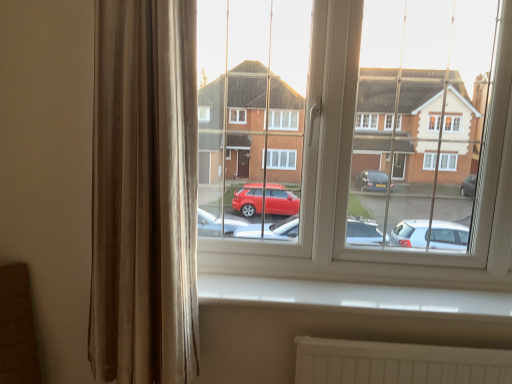
What is the approximate width of white plastic window sill at lower center?

white plastic window sill at lower center is 7.74 inches in width.

What do you see at coordinates (352, 295) in the screenshot?
I see `white plastic window sill at lower center` at bounding box center [352, 295].

Identify the location of velvet beige curtain at left. This screenshot has height=384, width=512. coord(144,193).

Is white plastic window sill at lower center bigger than velvet beige curtain at left?

No, white plastic window sill at lower center is not bigger than velvet beige curtain at left.

From a real-world perspective, is white plastic window sill at lower center located higher than velvet beige curtain at left?

No.

Is there a large distance between white plastic window sill at lower center and velvet beige curtain at left?

That's not correct — white plastic window sill at lower center is a little close to velvet beige curtain at left.

Which point is more forward, (318, 302) or (105, 142)?

The point (105, 142) is closer.

Between transparent glass window at center and white plastic window sill at lower center, which one has larger width?

white plastic window sill at lower center is wider.

Which is closer, (x=258, y=261) or (x=298, y=285)?

Positioned in front is point (x=298, y=285).

From a real-world perspective, which is physically below, transparent glass window at center or white plastic window sill at lower center?

white plastic window sill at lower center is physically lower.

Would you say transparent glass window at center is outside white plastic window sill at lower center?

Yes, transparent glass window at center is outside of white plastic window sill at lower center.

Does white plastic window sill at lower center have a smaller size compared to transparent glass window at center?

Yes.

Is white plastic window sill at lower center facing towards transparent glass window at center?

No, white plastic window sill at lower center is not oriented towards transparent glass window at center.

Considering the points (489, 312) and (499, 70), which point is behind, point (489, 312) or point (499, 70)?

The point (499, 70) is farther.

Is white plastic window sill at lower center situated inside transparent glass window at center or outside?

white plastic window sill at lower center is not enclosed by transparent glass window at center.

Between transparent glass window at center and velvet beige curtain at left, which one has smaller size?

velvet beige curtain at left is smaller.

Which object is positioned more to the right, transparent glass window at center or velvet beige curtain at left?

transparent glass window at center.

Is velvet beige curtain at left at the back of transparent glass window at center?

No, transparent glass window at center's orientation is not away from velvet beige curtain at left.

From a real-world perspective, is transparent glass window at center above or below velvet beige curtain at left?

From a real-world perspective, transparent glass window at center is physically above velvet beige curtain at left.

Considering the relative positions of velvet beige curtain at left and transparent glass window at center in the image provided, is velvet beige curtain at left to the left or to the right of transparent glass window at center?

velvet beige curtain at left is to the left of transparent glass window at center.

Which of these two, velvet beige curtain at left or transparent glass window at center, stands taller?

With more height is velvet beige curtain at left.

From a real-world perspective, is velvet beige curtain at left beneath transparent glass window at center?

Yes, from a real-world perspective, velvet beige curtain at left is under transparent glass window at center.

Considering the relative positions of velvet beige curtain at left and white plastic window sill at lower center in the image provided, is velvet beige curtain at left behind white plastic window sill at lower center?

No, it is in front of white plastic window sill at lower center.

From the image's perspective, which is below, velvet beige curtain at left or white plastic window sill at lower center?

white plastic window sill at lower center is shown below in the image.

Locate an element on the screen. window sill that appears on the right of velvet beige curtain at left is located at coordinates (352, 295).

Is velvet beige curtain at left taller or shorter than white plastic window sill at lower center?

Considering their sizes, velvet beige curtain at left has more height than white plastic window sill at lower center.

What are the coordinates of `window sill located underneath the velvet beige curtain at left (from a real-world perspective)` in the screenshot? It's located at (352, 295).

This screenshot has height=384, width=512. I want to click on window sill below the transparent glass window at center (from the image's perspective), so click(352, 295).

When comparing their distances from transparent glass window at center, does white plastic window sill at lower center or velvet beige curtain at left seem further?

velvet beige curtain at left is further to transparent glass window at center.

Estimate the real-world distances between objects in this image. Which object is further from velvet beige curtain at left, white plastic window sill at lower center or transparent glass window at center?

transparent glass window at center is positioned further to the anchor velvet beige curtain at left.

From the image, which object appears to be farther from white plastic window sill at lower center, transparent glass window at center or velvet beige curtain at left?

velvet beige curtain at left is further to white plastic window sill at lower center.

From the image, which object appears to be farther from white plastic window sill at lower center, velvet beige curtain at left or transparent glass window at center?

velvet beige curtain at left is positioned further to the anchor white plastic window sill at lower center.

Considering their positions, is velvet beige curtain at left positioned further to transparent glass window at center than white plastic window sill at lower center?

velvet beige curtain at left lies further to transparent glass window at center than the other object.

Looking at the image, which one is located closer to velvet beige curtain at left, transparent glass window at center or white plastic window sill at lower center?

white plastic window sill at lower center.

You are a GUI agent. You are given a task and a screenshot of the screen. Output one action in this format:
    pyautogui.click(x=<x>, y=<y>)
    Task: Click on the window sill located between velvet beige curtain at left and transparent glass window at center in the left-right direction
    
    Given the screenshot: What is the action you would take?
    pyautogui.click(x=352, y=295)